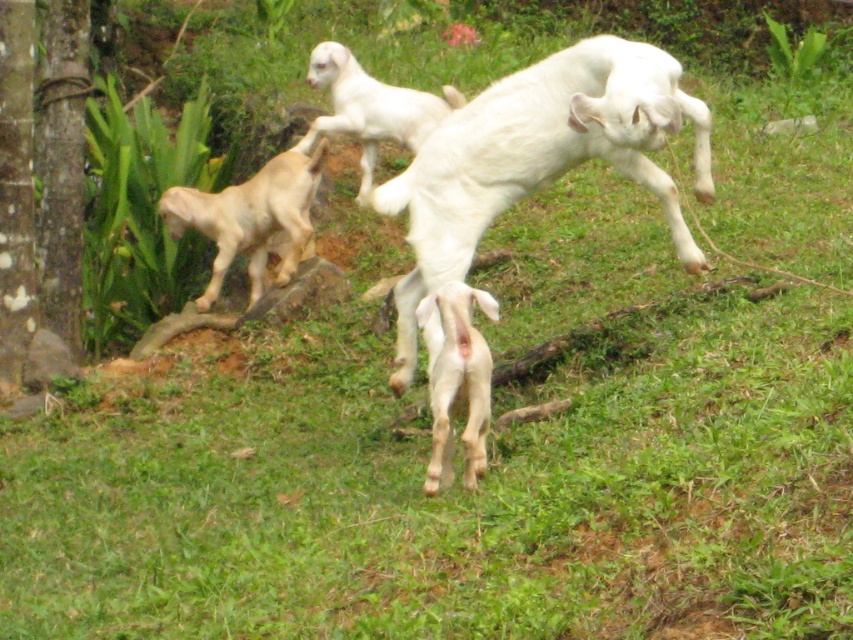
Measure the distance between point (x=639, y=84) and camera.

A distance of 5.41 meters exists between point (x=639, y=84) and camera.

Does white woolen goat at center have a lesser width compared to light beige fur at left?

No, white woolen goat at center is not thinner than light beige fur at left.

Which is behind, point (482, 100) or point (282, 259)?

Positioned behind is point (282, 259).

Find the location of a particular element. white woolen goat at center is located at coordinates (538, 157).

Is light beige fur at left thinner than white woolen goat at upper center?

Incorrect, light beige fur at left's width is not less than white woolen goat at upper center's.

Does light beige fur at left appear on the right side of white woolen goat at upper center?

In fact, light beige fur at left is to the left of white woolen goat at upper center.

Is point (183, 186) less distant than point (421, 92)?

No, (183, 186) is behind (421, 92).

Locate an element on the screen. The width and height of the screenshot is (853, 640). light beige fur at left is located at coordinates (252, 218).

Is light beige fur at left below white matte goat at center?

Actually, light beige fur at left is above white matte goat at center.

Does light beige fur at left have a smaller size compared to white matte goat at center?

No, light beige fur at left is not smaller than white matte goat at center.

Does point (229, 220) come farther from viewer compared to point (430, 467)?

That is True.

This screenshot has width=853, height=640. I want to click on light beige fur at left, so click(x=252, y=218).